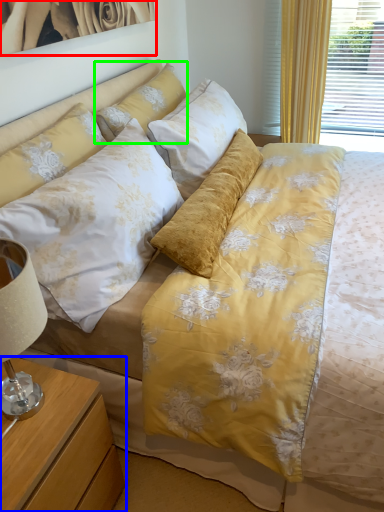
Question: Estimate the real-world distances between objects in this image. Which object is closer to picture frame (highlighted by a red box), nightstand (highlighted by a blue box) or pillow (highlighted by a green box)?

Choices:
 (A) nightstand
 (B) pillow

Answer: (B)